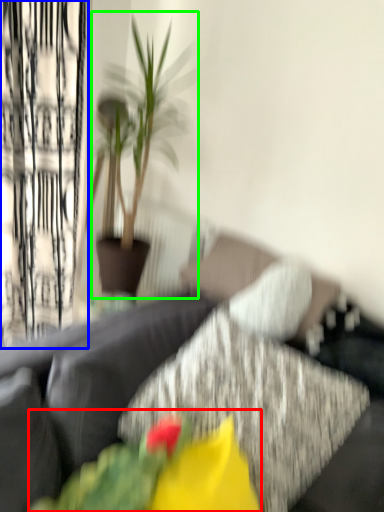
Question: Which object is the farthest from floral arrangement (highlighted by a red box)? Choose among these: curtain (highlighted by a blue box) or houseplant (highlighted by a green box).

Choices:
 (A) curtain
 (B) houseplant

Answer: (A)